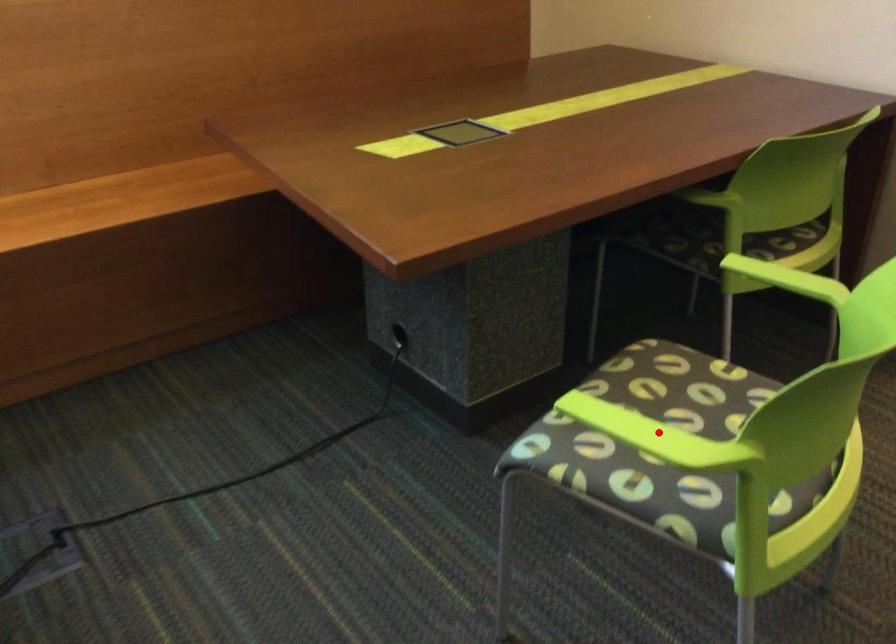
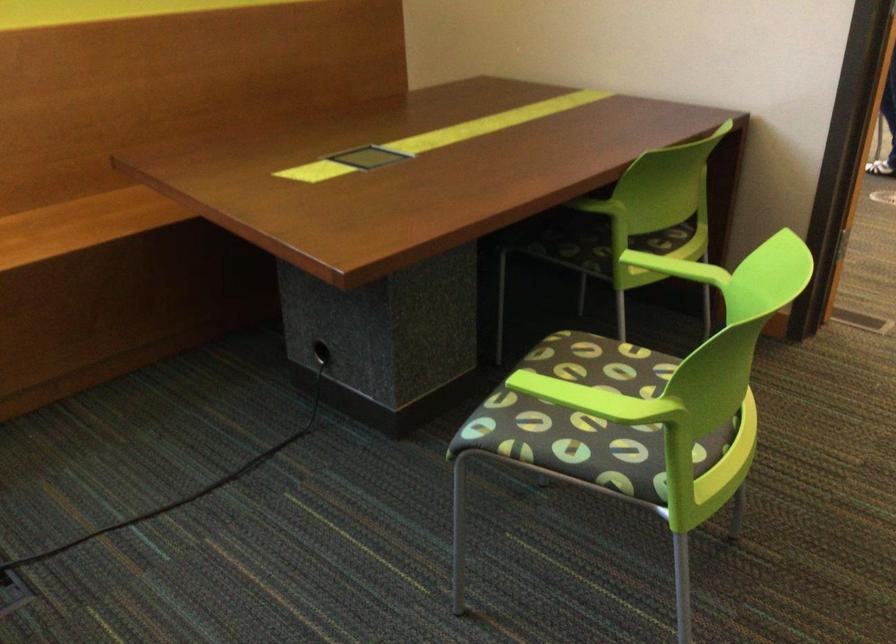
Question: I am providing you with two images of the same scene from different viewpoints. Given a red point in image1, look at the same physical point in image2. Is it:

Choices:
 (A) Closer to the viewpoint
 (B) Farther from the viewpoint

Answer: (B)